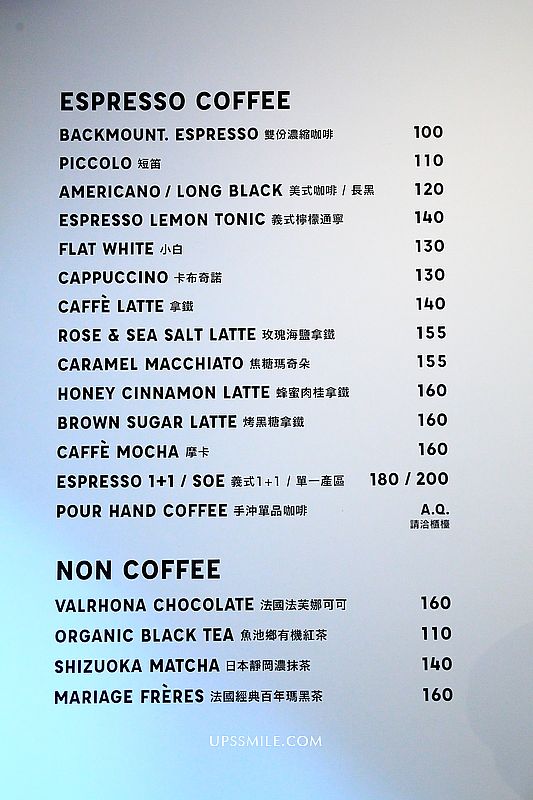
I want to click on espresso coffee, so click(x=72, y=98), click(x=204, y=94).